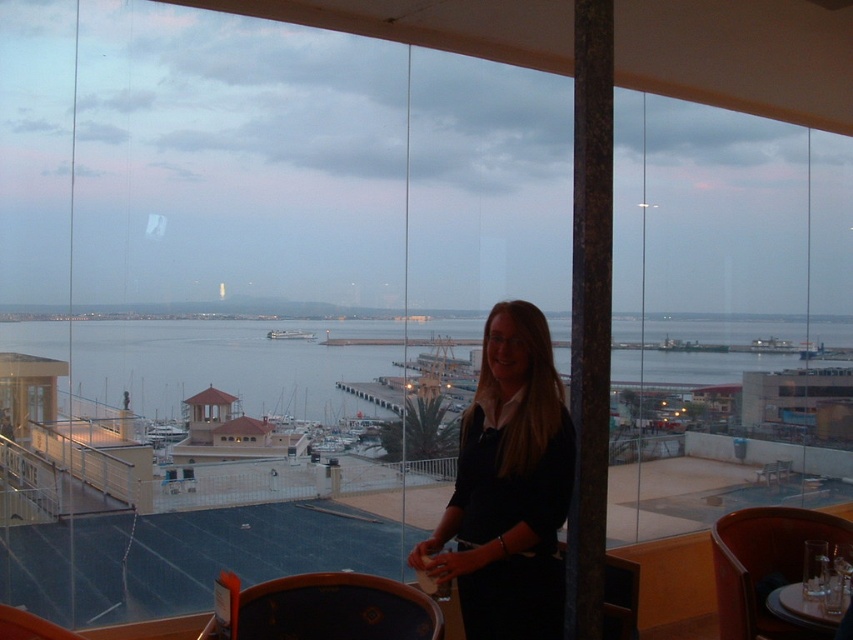
Consider the image. Between brown marble pillar at center and dark wood table at center, which one appears on the right side from the viewer's perspective?

From the viewer's perspective, brown marble pillar at center appears more on the right side.

Does point (589, 234) lie in front of point (376, 604)?

Yes, point (589, 234) is in front of point (376, 604).

Locate an element on the screen. This screenshot has height=640, width=853. brown marble pillar at center is located at coordinates (589, 310).

Does black matte shirt at center lie behind translucent glass table at center?

No, black matte shirt at center is closer to the viewer.

Is black matte shirt at center shorter than translucent glass table at center?

In fact, black matte shirt at center may be taller than translucent glass table at center.

Is point (538, 372) closer to viewer compared to point (801, 616)?

That is True.

This screenshot has height=640, width=853. In order to click on black matte shirt at center in this screenshot , I will do `click(508, 486)`.

Can you confirm if dark wood table at center is positioned above translucent glass table at center?

Yes, dark wood table at center is above translucent glass table at center.

Measure the distance between dark wood table at center and camera.

dark wood table at center and camera are 8.17 feet apart from each other.

Between point (283, 614) and point (773, 605), which one is positioned in front?

Point (283, 614) is in front.

You are a GUI agent. You are given a task and a screenshot of the screen. Output one action in this format:
    pyautogui.click(x=<x>, y=<y>)
    Task: Click on the dark wood table at center
    
    Given the screenshot: What is the action you would take?
    [322, 609]